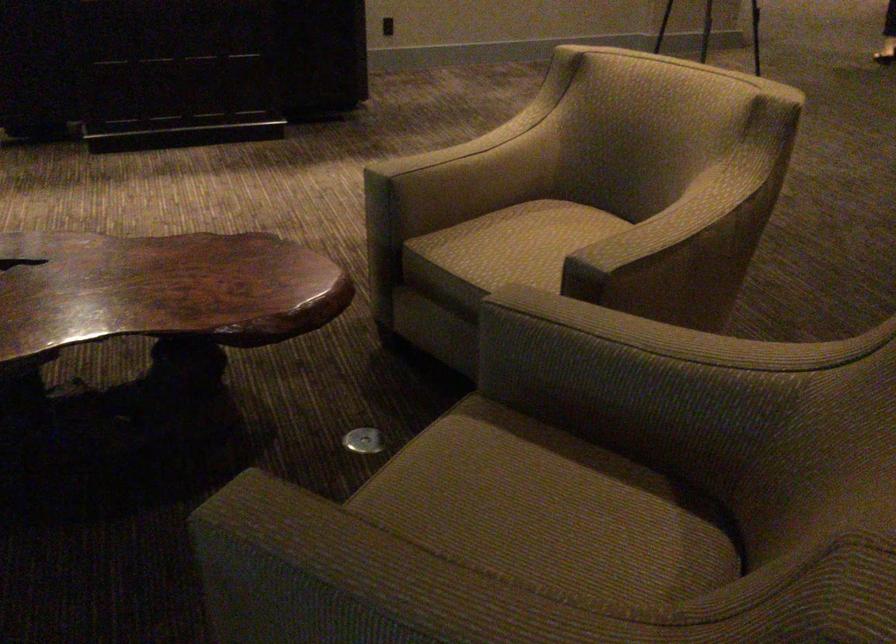
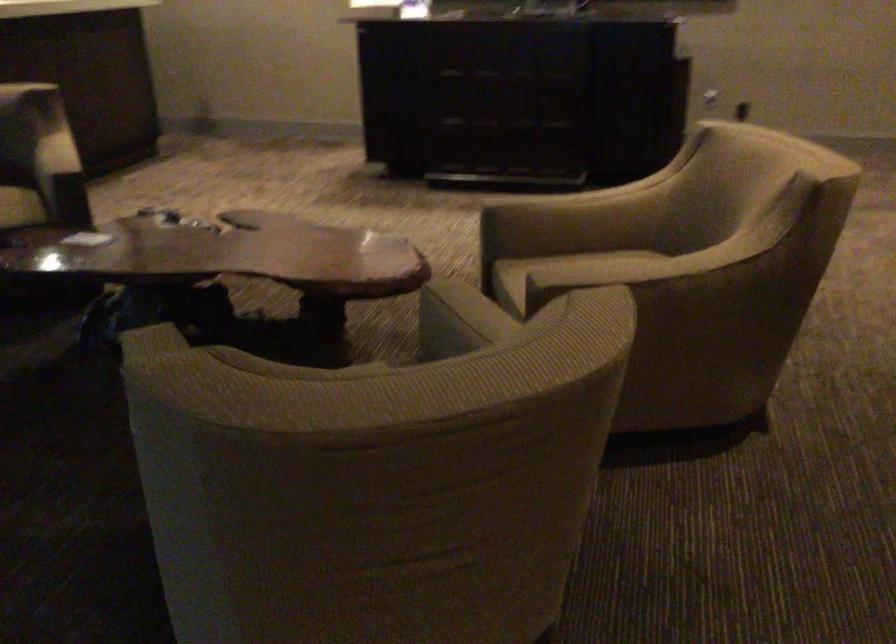
Locate, in the second image, the point that corresponds to point 444,158 in the first image.

(547, 200)